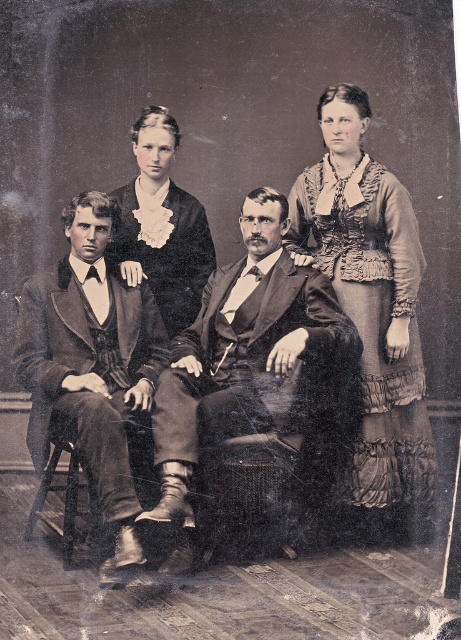
Question: Which point is closer to the camera taking this photo?

Choices:
 (A) (130, 486)
 (B) (163, 202)

Answer: (A)

Question: Is matte black suit at center thinner than matte brown suit at left?

Choices:
 (A) yes
 (B) no

Answer: (B)

Question: Where is smooth brown suit at center located in relation to matte black dress at center in the image?

Choices:
 (A) below
 (B) above

Answer: (A)

Question: Which point appears closest to the camera in this image?

Choices:
 (A) (325, 234)
 (B) (318, 164)
 (C) (101, 328)

Answer: (C)

Question: In this image, where is matte black suit at center located relative to ruffled fabric dress at right?

Choices:
 (A) above
 (B) below

Answer: (A)

Question: Which point appears farthest from the camera in this image?

Choices:
 (A) (134, 262)
 (B) (390, 316)

Answer: (A)